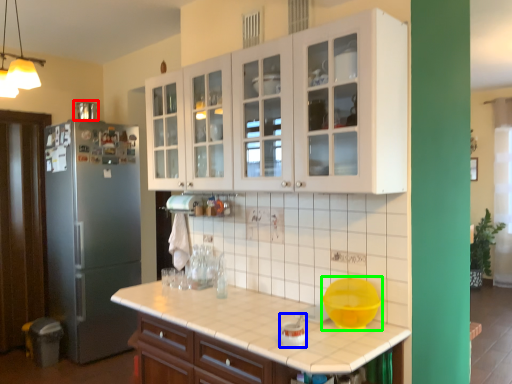
Question: Based on their relative distances, which object is farther from appliance (highlighted by a red box)? Choose from appliance (highlighted by a blue box) and mixing bowl (highlighted by a green box).

Choices:
 (A) appliance
 (B) mixing bowl

Answer: (A)